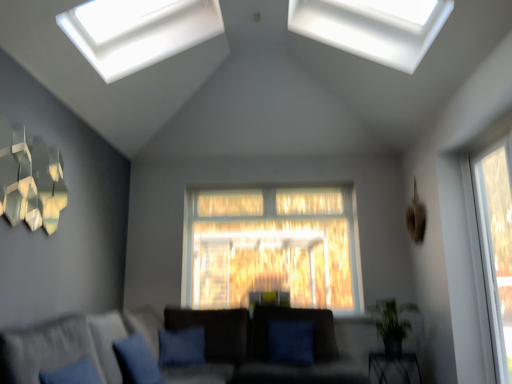
Question: Can you confirm if metallic geometric art at upper left is positioned to the right of blue fabric pillow at lower center?

Choices:
 (A) yes
 (B) no

Answer: (B)

Question: Considering the relative sizes of metallic geometric art at upper left and blue fabric pillow at lower center in the image provided, is metallic geometric art at upper left shorter than blue fabric pillow at lower center?

Choices:
 (A) no
 (B) yes

Answer: (A)

Question: Considering the relative sizes of metallic geometric art at upper left and blue fabric pillow at lower center in the image provided, is metallic geometric art at upper left bigger than blue fabric pillow at lower center?

Choices:
 (A) no
 (B) yes

Answer: (A)

Question: Is metallic geometric art at upper left located outside blue fabric pillow at lower center?

Choices:
 (A) yes
 (B) no

Answer: (A)

Question: Would you say blue fabric pillow at lower center is part of metallic geometric art at upper left's contents?

Choices:
 (A) yes
 (B) no

Answer: (B)

Question: In terms of width, does green leafy plant at lower right look wider or thinner when compared to dark gray fabric couch at lower left?

Choices:
 (A) wide
 (B) thin

Answer: (B)

Question: Is point (399, 306) closer or farther from the camera than point (275, 379)?

Choices:
 (A) closer
 (B) farther

Answer: (B)

Question: Is green leafy plant at lower right spatially inside dark gray fabric couch at lower left, or outside of it?

Choices:
 (A) outside
 (B) inside

Answer: (A)

Question: Is green leafy plant at lower right bigger or smaller than dark gray fabric couch at lower left?

Choices:
 (A) big
 (B) small

Answer: (B)

Question: From the image's perspective, is blue fabric pillow at center located above or below metallic black table at lower right?

Choices:
 (A) below
 (B) above

Answer: (B)

Question: Considering the positions of blue fabric pillow at center and metallic black table at lower right in the image, is blue fabric pillow at center wider or thinner than metallic black table at lower right?

Choices:
 (A) wide
 (B) thin

Answer: (B)

Question: From a real-world perspective, is blue fabric pillow at center positioned above or below metallic black table at lower right?

Choices:
 (A) above
 (B) below

Answer: (A)

Question: In the image, is blue fabric pillow at center on the left side or the right side of metallic black table at lower right?

Choices:
 (A) right
 (B) left

Answer: (B)

Question: From the image's perspective, relative to green leafy plant at lower right, is transparent glass window at upper center, the 3th window viewed from the right, above or below?

Choices:
 (A) below
 (B) above

Answer: (B)

Question: Would you say transparent glass window at upper center, the 2th window in the bottom-to-top sequence, is to the left or to the right of green leafy plant at lower right in the picture?

Choices:
 (A) right
 (B) left

Answer: (B)